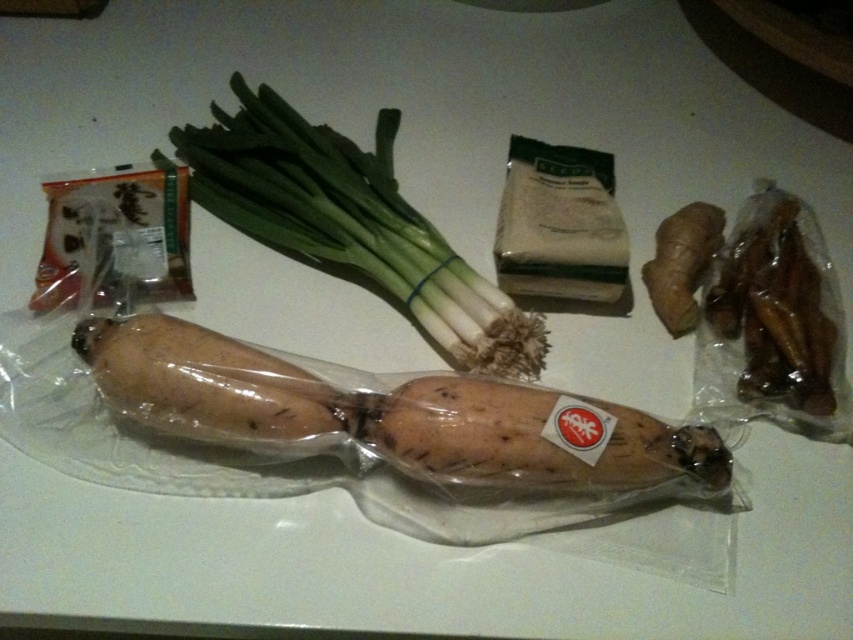
Does brown matte sweet potato at center appear on the left side of brown glossy dried mushrooms at right?

Indeed, brown matte sweet potato at center is positioned on the left side of brown glossy dried mushrooms at right.

Which is in front, point (538, 436) or point (820, 268)?

Point (538, 436) is more forward.

The image size is (853, 640). I want to click on brown matte sweet potato at center, so click(x=538, y=436).

Between brown glossy dried mushrooms at right and brown rough ginger at upper right, which one has less height?

With less height is brown rough ginger at upper right.

Between point (769, 291) and point (701, 230), which one is positioned in front?

Point (769, 291) is in front.

This screenshot has width=853, height=640. Find the location of `brown glossy dried mushrooms at right`. brown glossy dried mushrooms at right is located at coordinates (778, 305).

The width and height of the screenshot is (853, 640). What are the coordinates of `brown glossy dried mushrooms at right` in the screenshot? It's located at (778, 305).

Consider the image. Is green leafy at center in front of brown glossy dried mushrooms at right?

No, green leafy at center is further to the viewer.

Measure the distance between green leafy at center and camera.

green leafy at center is 3.93 feet away from camera.

Between point (360, 196) and point (801, 349), which one is positioned behind?

Positioned behind is point (360, 196).

This screenshot has width=853, height=640. Identify the location of green leafy at center. (352, 221).